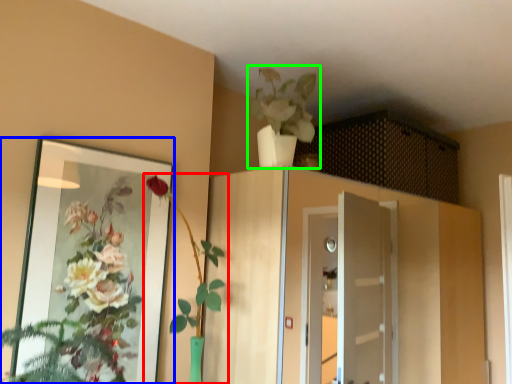
Question: Considering the real-world distances, which object is closest to houseplant (highlighted by a red box)? mirror (highlighted by a blue box) or houseplant (highlighted by a green box).

Choices:
 (A) mirror
 (B) houseplant

Answer: (A)